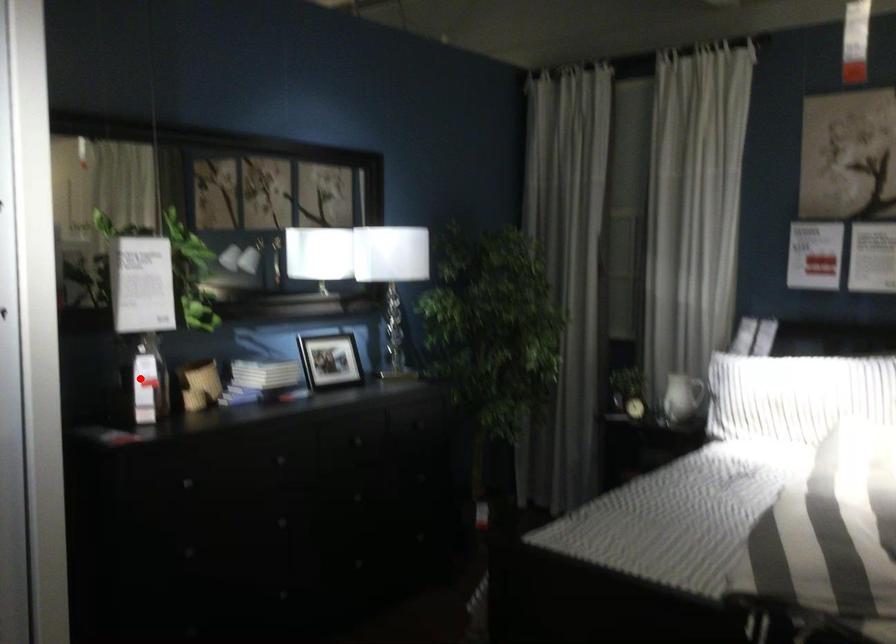
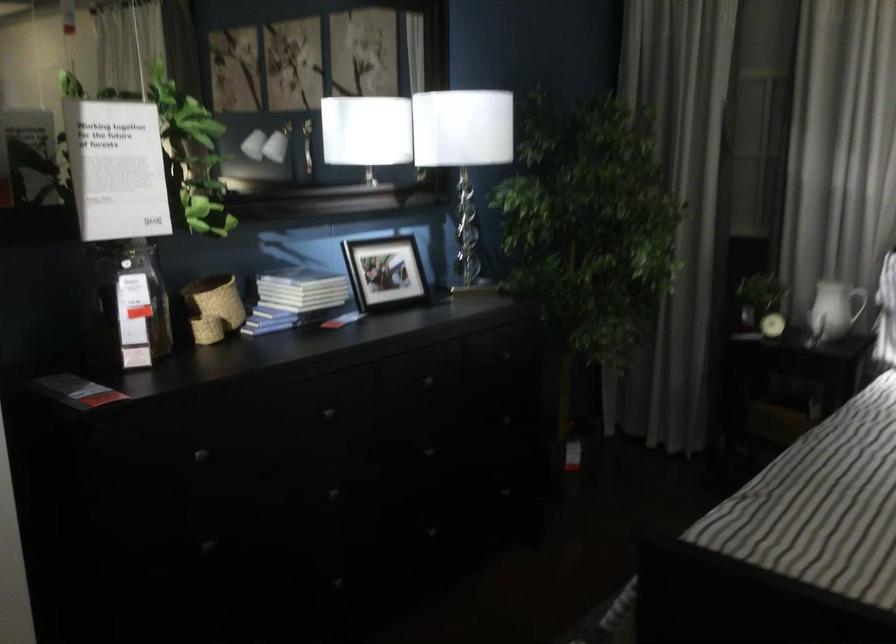
In the second image, find the point that corresponds to the highlighted location in the first image.

(126, 305)